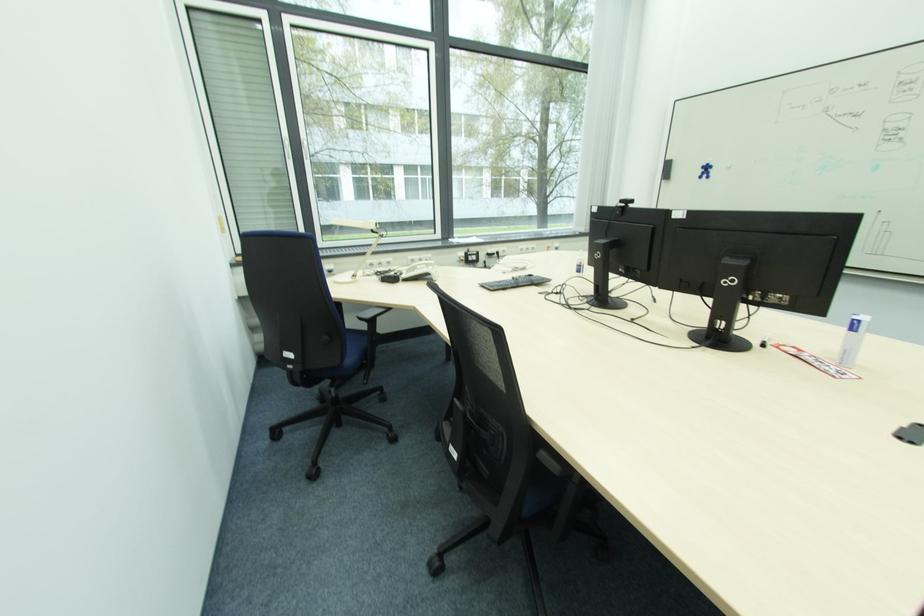
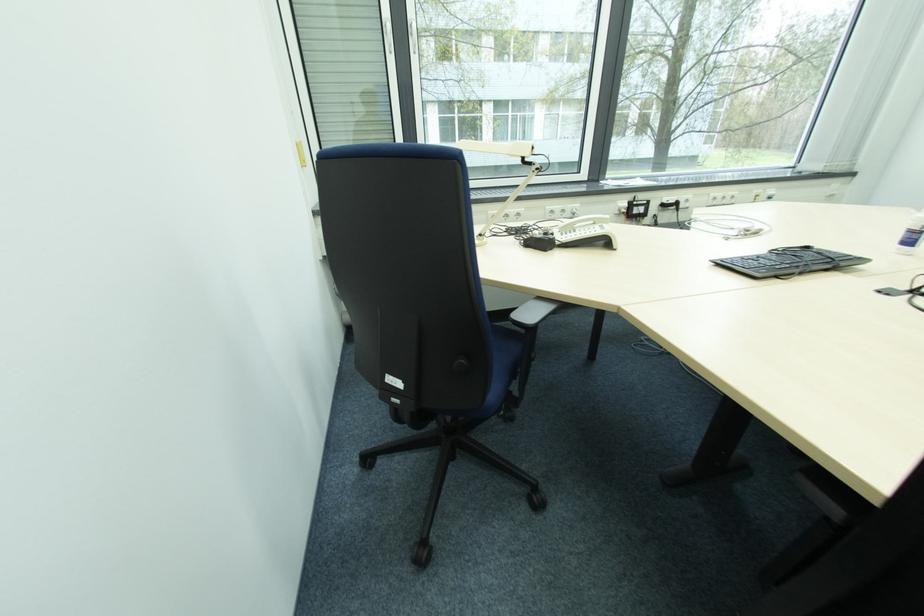
The images are taken continuously from a first-person perspective. In which direction are you moving?

The cameraman walked toward left, forward.